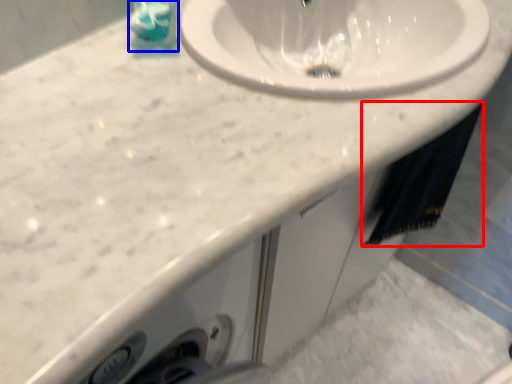
Question: Which object appears farthest to the camera in this image, bath towel (highlighted by a red box) or liquid (highlighted by a blue box)?

Choices:
 (A) bath towel
 (B) liquid

Answer: (A)